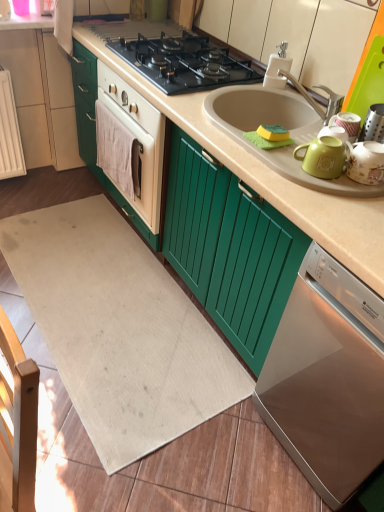
Question: Considering the relative sizes of white cloth towel at center and white plastic faucet at upper right in the image provided, is white cloth towel at center shorter than white plastic faucet at upper right?

Choices:
 (A) yes
 (B) no

Answer: (B)

Question: Is white cloth towel at center to the left of white plastic faucet at upper right from the viewer's perspective?

Choices:
 (A) no
 (B) yes

Answer: (B)

Question: Does white cloth towel at center have a lesser width compared to white plastic faucet at upper right?

Choices:
 (A) yes
 (B) no

Answer: (A)

Question: From a real-world perspective, is white cloth towel at center on white plastic faucet at upper right?

Choices:
 (A) yes
 (B) no

Answer: (B)

Question: Can we say white cloth towel at center lies outside white plastic faucet at upper right?

Choices:
 (A) yes
 (B) no

Answer: (A)

Question: Is white cloth towel at center smaller than white plastic faucet at upper right?

Choices:
 (A) no
 (B) yes

Answer: (A)

Question: Can you confirm if green sponge at sink is positioned to the right of matte green tea pot at right?

Choices:
 (A) yes
 (B) no

Answer: (B)

Question: Is green sponge at sink closer to camera compared to matte green tea pot at right?

Choices:
 (A) yes
 (B) no

Answer: (B)

Question: Could you tell me if green sponge at sink is turned towards matte green tea pot at right?

Choices:
 (A) no
 (B) yes

Answer: (A)

Question: Does green sponge at sink have a lesser width compared to matte green tea pot at right?

Choices:
 (A) yes
 (B) no

Answer: (A)

Question: From the image's perspective, is green sponge at sink beneath matte green tea pot at right?

Choices:
 (A) yes
 (B) no

Answer: (B)

Question: Is green sponge at sink positioned beyond the bounds of matte green tea pot at right?

Choices:
 (A) yes
 (B) no

Answer: (A)

Question: From a real-world perspective, is matte green tea pot at right located higher than white plastic faucet at upper right?

Choices:
 (A) no
 (B) yes

Answer: (A)